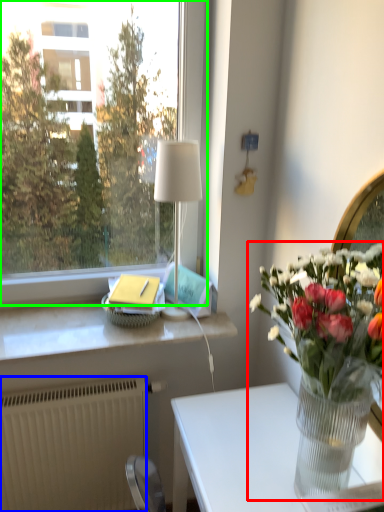
Question: Considering the real-world distances, which object is farthest from houseplant (highlighted by a red box)? radiator (highlighted by a blue box) or window (highlighted by a green box)?

Choices:
 (A) radiator
 (B) window

Answer: (B)